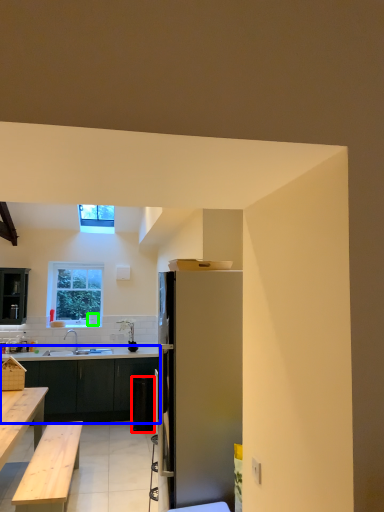
Question: Which object is positioned closest to trash bin/can (highlighted by a red box)? Select from kitchen & dining room table (highlighted by a blue box) and coffee cup (highlighted by a green box).

Choices:
 (A) kitchen & dining room table
 (B) coffee cup

Answer: (A)